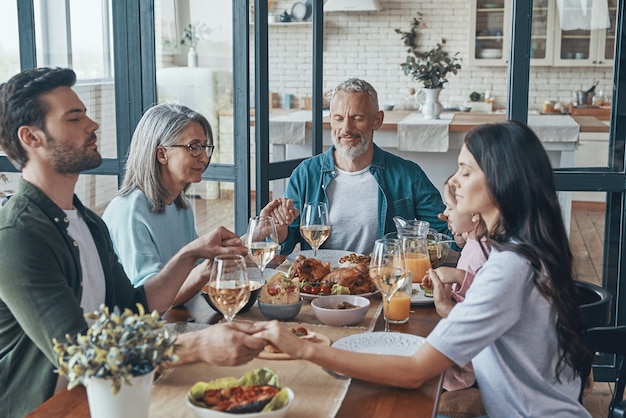
What are the coordinates of `wine glasses` in the screenshot? It's located at (225, 281), (265, 236), (312, 216), (387, 259).